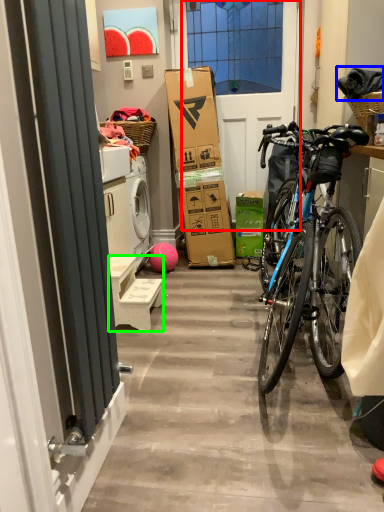
Question: Which object is positioned farthest from screen door (highlighted by a red box)? Select from material (highlighted by a blue box) and furniture (highlighted by a green box).

Choices:
 (A) material
 (B) furniture

Answer: (B)